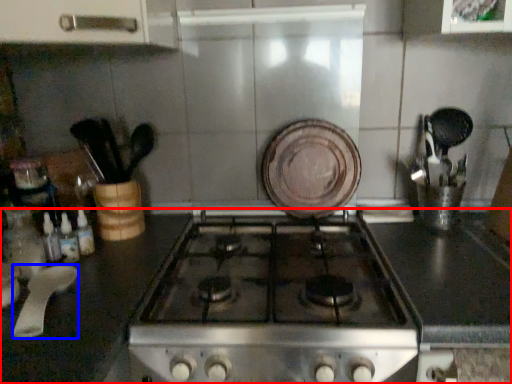
Question: Which point is further to the camera, countertop (highlighted by a red box) or kitchen appliance (highlighted by a blue box)?

Choices:
 (A) countertop
 (B) kitchen appliance

Answer: (B)